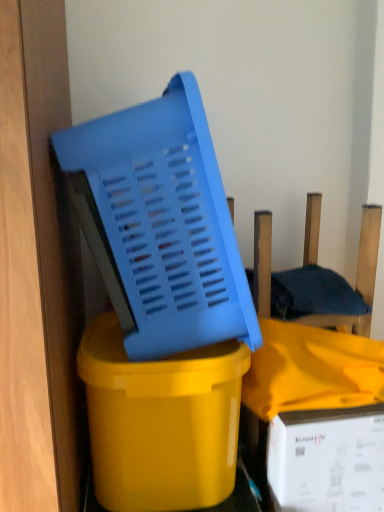
Question: Would you say yellow glossy plastic bucket at center is to the left or to the right of blue plastic chair at center in the picture?

Choices:
 (A) right
 (B) left

Answer: (B)

Question: Is yellow glossy plastic bucket at center bigger or smaller than blue plastic chair at center?

Choices:
 (A) big
 (B) small

Answer: (A)

Question: Which object is the farthest from the yellow glossy plastic bucket at center?

Choices:
 (A) white cardboard box at lower right
 (B) blue plastic chair at center
 (C) blue plastic basket at center

Answer: (B)

Question: Which of these objects is positioned farthest from the yellow glossy plastic bucket at center?

Choices:
 (A) blue plastic chair at center
 (B) blue plastic basket at center
 (C) white cardboard box at lower right

Answer: (A)